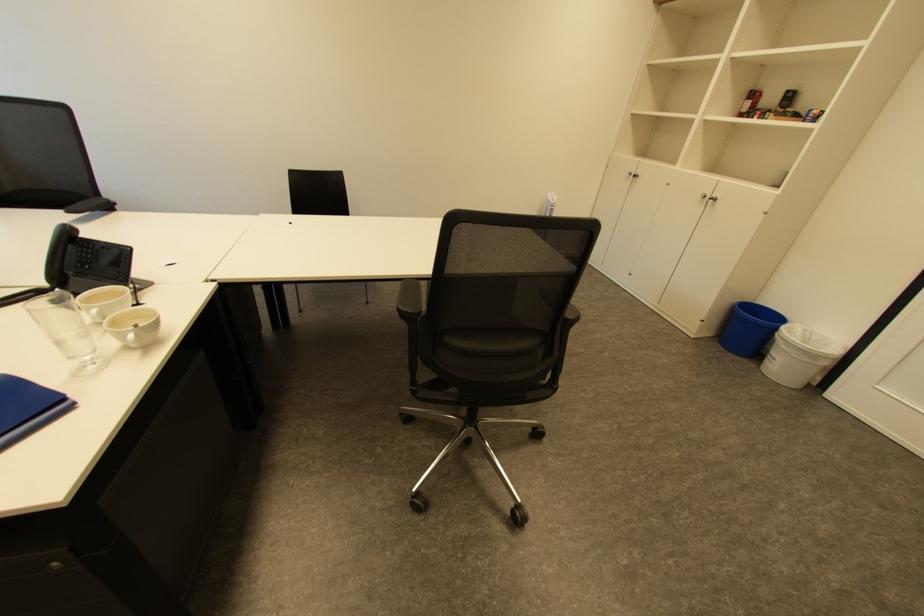
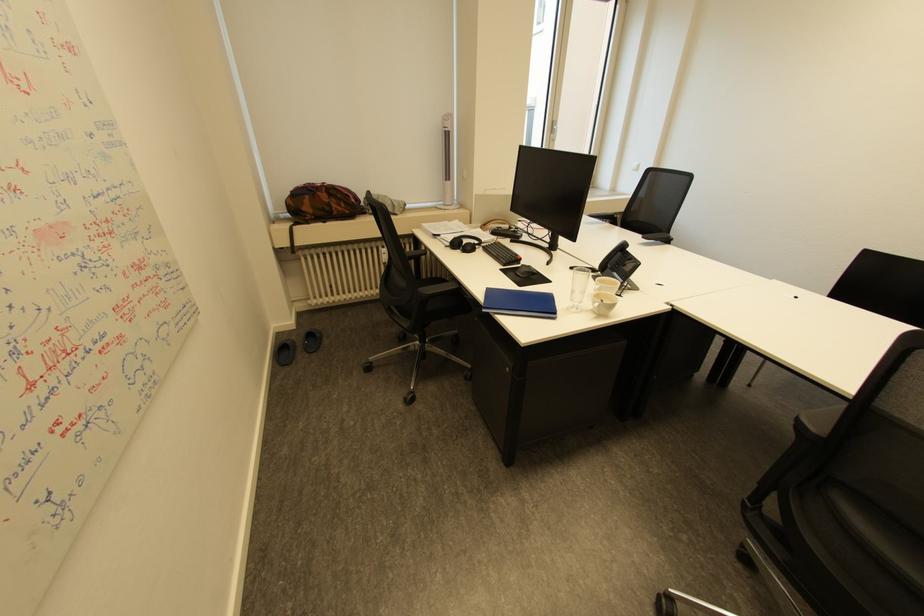
Locate, in the second image, the point that corresponds to (x=76, y=358) in the first image.

(578, 300)